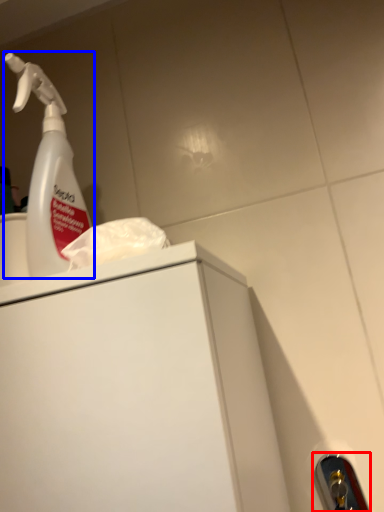
Question: Which object appears closest to the camera in this image, door handle (highlighted by a red box) or cleaning product (highlighted by a blue box)?

Choices:
 (A) door handle
 (B) cleaning product

Answer: (B)